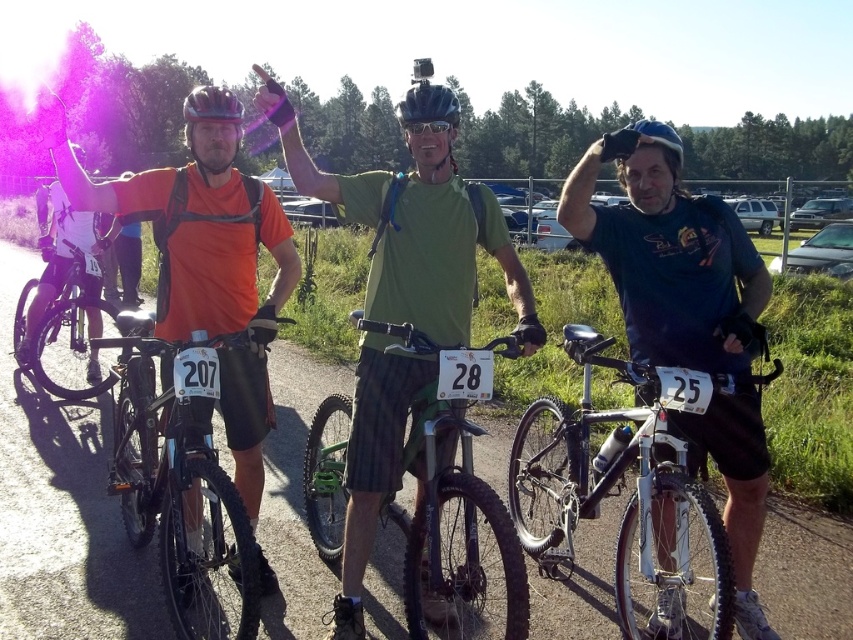
Does matte orange shirt at center have a greater height compared to matte black bicycle at center?

Yes, matte orange shirt at center is taller than matte black bicycle at center.

Measure the distance between matte orange shirt at center and camera.

matte orange shirt at center is 10.08 feet from camera.

Locate an element on the screen. matte orange shirt at center is located at coordinates (210, 269).

Is point (407, 378) closer to viewer compared to point (412, 125)?

No, it is behind (412, 125).

Can you confirm if green matte shirt at center is positioned to the left of transparent plastic goggles at center?

Yes, green matte shirt at center is to the left of transparent plastic goggles at center.

The image size is (853, 640). In order to click on green matte shirt at center in this screenshot , I will do `click(415, 230)`.

Is dark blue t-shirt at center smaller than matte orange shirt at center?

No.

Who is taller, dark blue t-shirt at center or matte orange shirt at center?

dark blue t-shirt at center is taller.

Does point (648, 256) lie behind point (291, 291)?

No.

This screenshot has height=640, width=853. What are the coordinates of `dark blue t-shirt at center` in the screenshot? It's located at (686, 314).